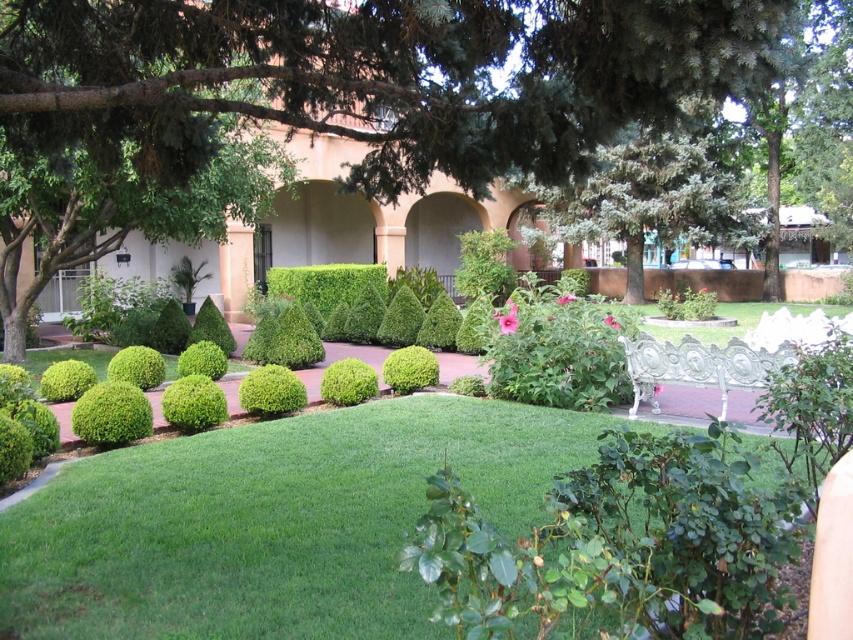
You are a gardener planning to place a new decorative stone path that is 2 meters wide. You want to ensure it fits between the green smooth grass at center and the green matte shrub at center. Can you determine if there is enough space for the path based on their widths?

The green smooth grass at center might be wider than the green matte shrub at center, but without exact measurements, it is uncertain if the 2 meter wide path will fit. Further measurement is needed.

You are standing in the garden and want to take a photo of the green leafy tree at center. If your camera has a maximum focus range of 9 feet, will it be able to capture the tree clearly?

The green leafy tree at center is 8.98 feet away from the viewer, which is within the camera maximum focus range of 9 feet. Therefore, the camera can capture the tree clearly.

You are a gardener who needs to water both the green leafy tree at center and the green smooth grass at center. Based on their positions, which one should you water first if you start from the left side of the pathway?

Answer: The green smooth grass at center should be watered first because the green leafy tree at center is to the right of it, meaning the grass is closer to the starting point on the left side of the pathway.